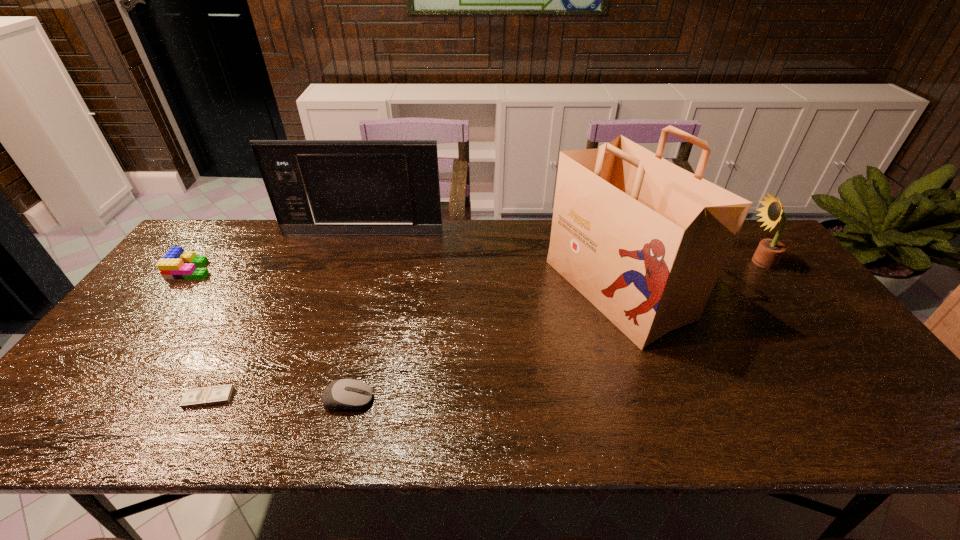
The height and width of the screenshot is (540, 960). Find the location of `grocery bag located in the far edge section of the desktop`. grocery bag located in the far edge section of the desktop is located at coordinates (644, 240).

I want to click on microwave oven that is positioned at the far edge, so click(x=316, y=187).

Locate an element on the screen. The width and height of the screenshot is (960, 540). sunflower that is positioned at the far edge is located at coordinates (769, 252).

The width and height of the screenshot is (960, 540). I want to click on Lego at the far edge, so point(176,264).

The image size is (960, 540). Find the location of `computer equipment that is at the near edge`. computer equipment that is at the near edge is located at coordinates (344, 394).

Locate an element on the screen. Image resolution: width=960 pixels, height=540 pixels. money situated at the near edge is located at coordinates (214, 395).

Where is `object at the left edge`? Image resolution: width=960 pixels, height=540 pixels. object at the left edge is located at coordinates 176,264.

Locate an element on the screen. This screenshot has width=960, height=540. object that is at the right edge is located at coordinates (769, 252).

The image size is (960, 540). Find the location of `object positioned at the far left corner`. object positioned at the far left corner is located at coordinates (176, 264).

You are a GUI agent. You are given a task and a screenshot of the screen. Output one action in this format:
    pyautogui.click(x=<x>, y=<y>)
    Task: Click on the object at the far right corner
    The width and height of the screenshot is (960, 540).
    Given the screenshot: What is the action you would take?
    pyautogui.click(x=769, y=252)